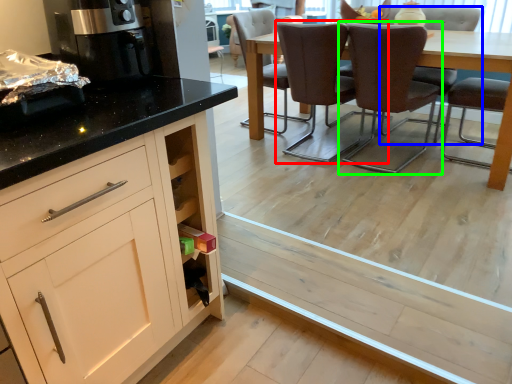
Question: Considering the real-world distances, which object is closest to chair (highlighted by a red box)? chair (highlighted by a blue box) or chair (highlighted by a green box).

Choices:
 (A) chair
 (B) chair

Answer: (B)